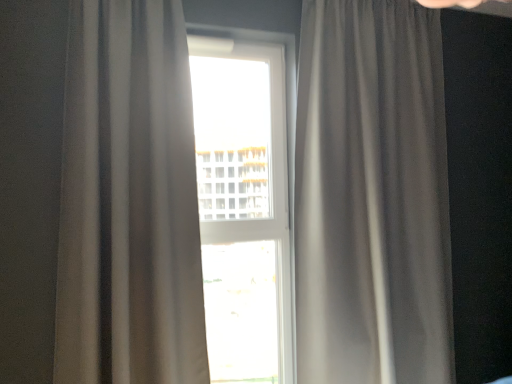
Question: Considering the relative sizes of matte gray curtain at center, acting as the 2th curtain starting from the right, and transparent glass window at center in the image provided, is matte gray curtain at center, acting as the 2th curtain starting from the right, thinner than transparent glass window at center?

Choices:
 (A) no
 (B) yes

Answer: (A)

Question: Is matte gray curtain at center, acting as the 2th curtain starting from the right, not inside transparent glass window at center?

Choices:
 (A) yes
 (B) no

Answer: (A)

Question: Are matte gray curtain at center, arranged as the 1th curtain when viewed from the left, and transparent glass window at center making contact?

Choices:
 (A) no
 (B) yes

Answer: (A)

Question: Could you tell me if matte gray curtain at center, acting as the 2th curtain starting from the right, is turned towards transparent glass window at center?

Choices:
 (A) no
 (B) yes

Answer: (A)

Question: Is matte gray curtain at center, arranged as the 1th curtain when viewed from the left, facing away from transparent glass window at center?

Choices:
 (A) yes
 (B) no

Answer: (B)

Question: From the image's perspective, is matte gray curtain at center, acting as the 2th curtain starting from the right, above or below transparent glass window at center?

Choices:
 (A) above
 (B) below

Answer: (A)

Question: Considering the positions of matte gray curtain at center, arranged as the 1th curtain when viewed from the left, and transparent glass window at center in the image, is matte gray curtain at center, arranged as the 1th curtain when viewed from the left, taller or shorter than transparent glass window at center?

Choices:
 (A) short
 (B) tall

Answer: (A)

Question: Which is correct: matte gray curtain at center, acting as the 2th curtain starting from the right, is inside transparent glass window at center, or outside of it?

Choices:
 (A) inside
 (B) outside

Answer: (B)

Question: Is matte gray curtain at center, acting as the 2th curtain starting from the right, bigger or smaller than transparent glass window at center?

Choices:
 (A) small
 (B) big

Answer: (B)

Question: Is point (x=207, y=127) positioned closer to the camera than point (x=331, y=91)?

Choices:
 (A) farther
 (B) closer

Answer: (A)

Question: Based on their positions, is transparent glass window at center located to the left or right of satin gray curtain at right, which appears as the 2th curtain when viewed from the left?

Choices:
 (A) left
 (B) right

Answer: (A)

Question: In terms of width, does transparent glass window at center look wider or thinner when compared to satin gray curtain at right, which is the 1th curtain in right-to-left order?

Choices:
 (A) wide
 (B) thin

Answer: (B)

Question: From their relative heights in the image, would you say transparent glass window at center is taller or shorter than satin gray curtain at right, which appears as the 2th curtain when viewed from the left?

Choices:
 (A) tall
 (B) short

Answer: (B)

Question: Visually, is satin gray curtain at right, which appears as the 2th curtain when viewed from the left, positioned to the left or to the right of matte gray curtain at center, arranged as the 1th curtain when viewed from the left?

Choices:
 (A) left
 (B) right

Answer: (B)

Question: Looking at their shapes, would you say satin gray curtain at right, which is the 1th curtain in right-to-left order, is wider or thinner than matte gray curtain at center, arranged as the 1th curtain when viewed from the left?

Choices:
 (A) thin
 (B) wide

Answer: (B)